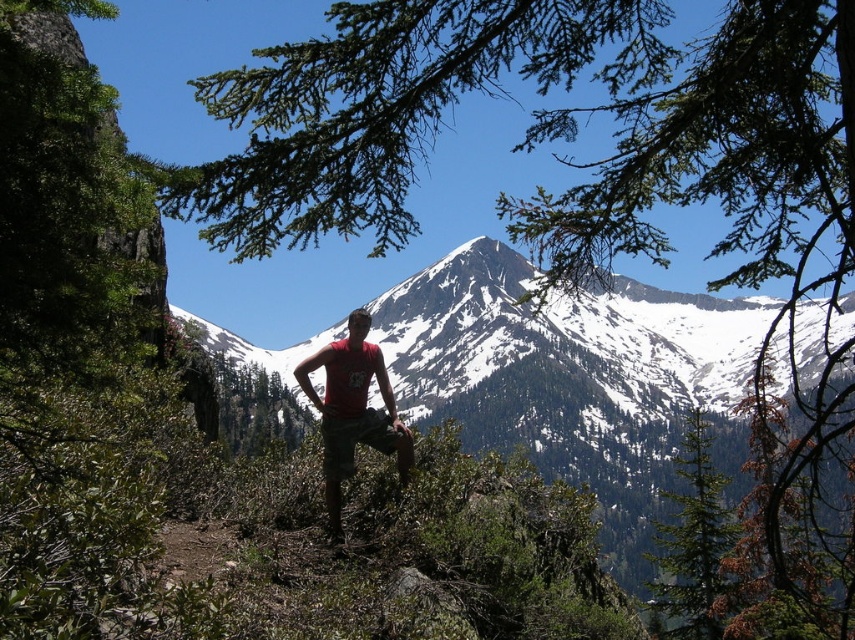
You are a photographer trying to capture the green textured tree at center in your shot. Based on the scene description, where should you position the tree in your camera frame?

The green textured tree at center should be positioned at the point with coordinates 0.850 on the x axis and 0.809 on the y axis in the camera frame.